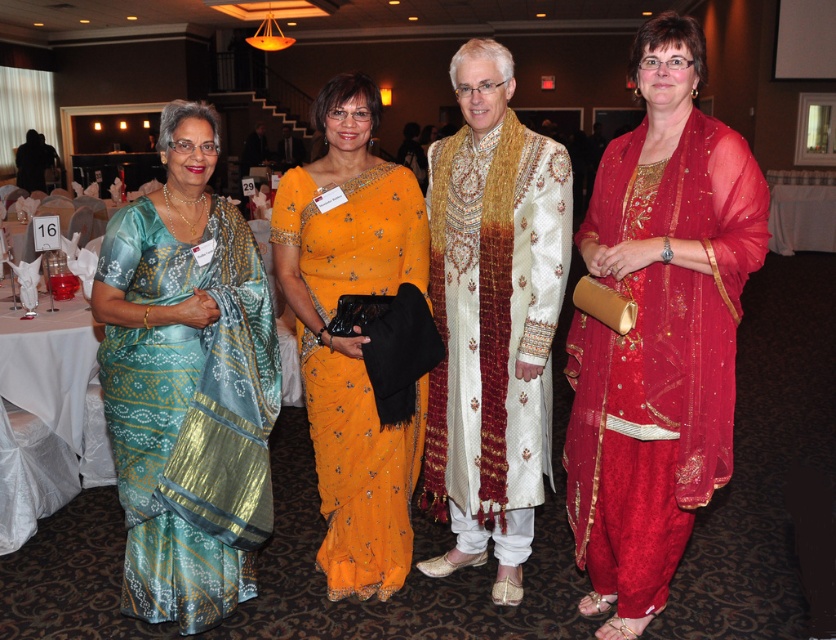
You are attending a formal event and notice two guests wearing the white silk sherwani at center and the orange silk saree at center. From your perspective facing the group, which one is positioned to the right?

The white silk sherwani at center is to the right of the orange silk saree at center, so the white silk sherwani at center is positioned to the right.

You are a photographer at the event and need to ensure the teal silk saree at left and the orange silk saree at center are both visible in the photo. Based on their positions and the description, which saree might require more space in the frame to accommodate its width?

The teal silk saree at left might require more space in the frame because it is wider than the orange silk saree at center according to the description.

You are at a formal event and see two people wearing the teal silk saree at left and the orange silk saree at center. Which one is standing more to the left?

The teal silk saree at left is more to the left than the orange silk saree at center.